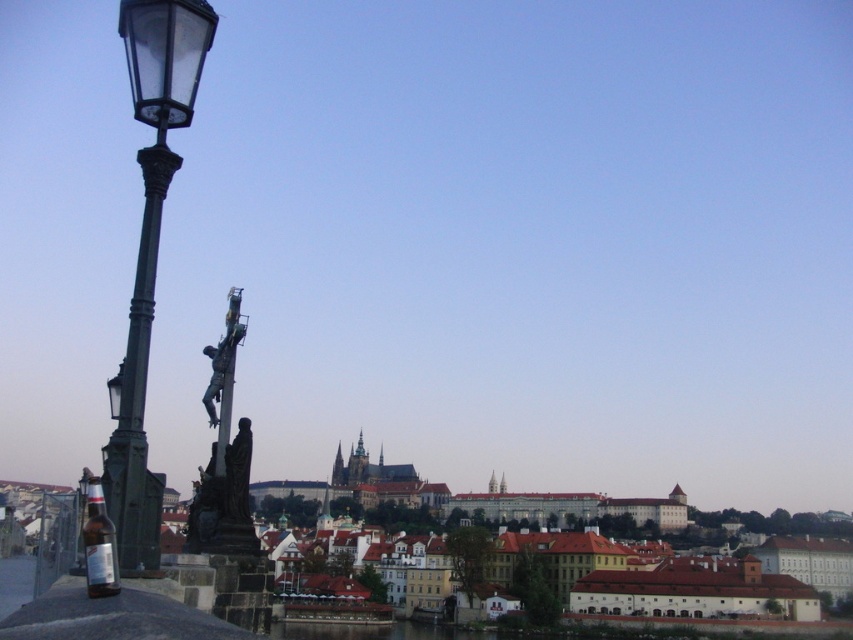
You are a city planner analyzing the layout of this historic city. You notice a point marked at coordinates (149, 252). Based on the scene description, what object is located at this point?

The point at coordinates (149, 252) marks the location of the matte black street light at left.

You are standing at the center of the image. Which direction should you look to see the matte black street light at left?

You should look to the left to see the matte black street light at left.